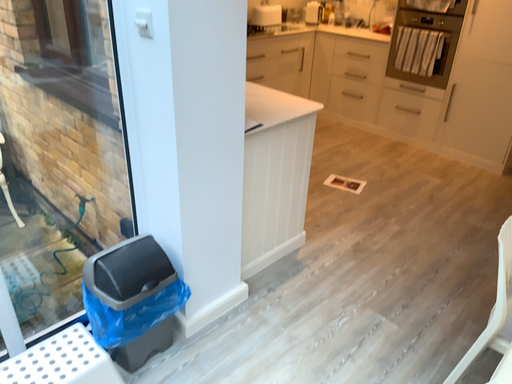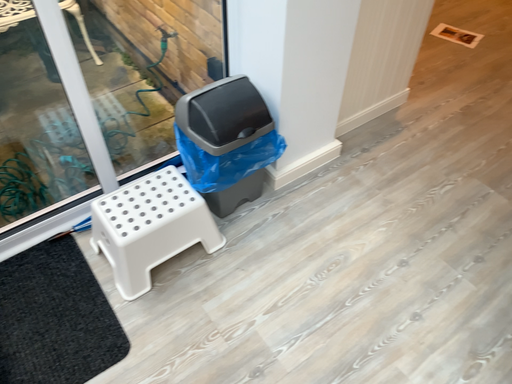
Question: How did the camera likely rotate when shooting the video?

Choices:
 (A) rotated right
 (B) rotated left

Answer: (B)